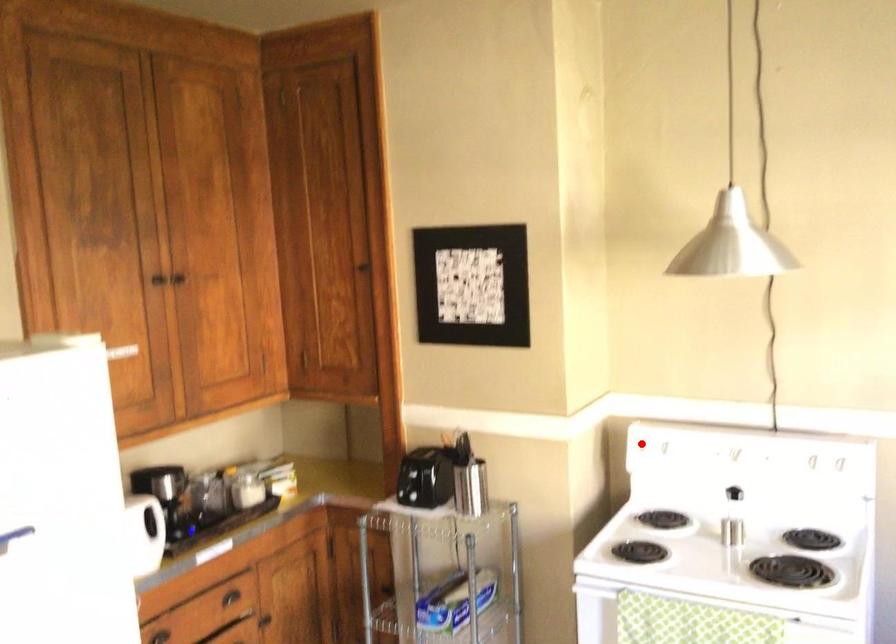
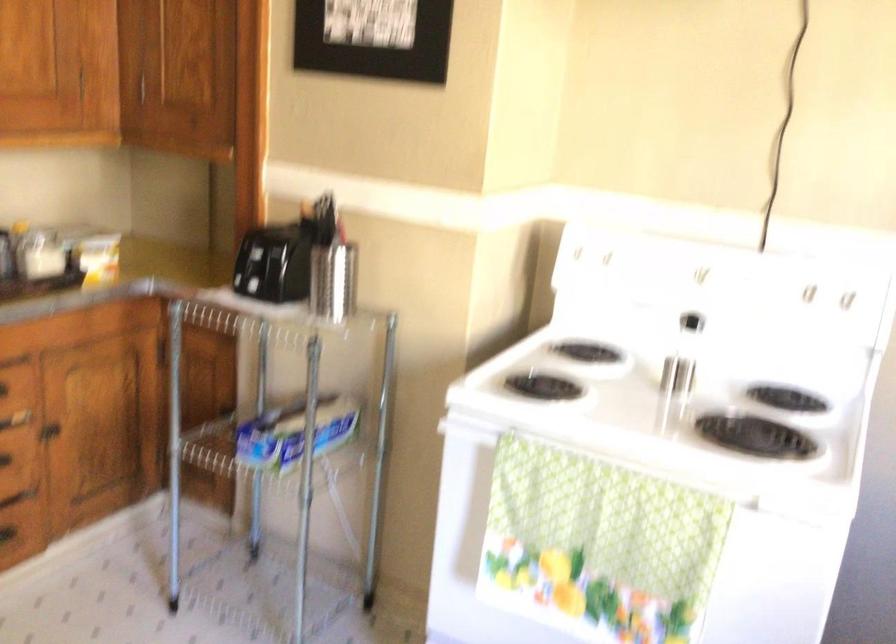
Where in the second image is the point corresponding to the highlighted location from the first image?

(576, 252)